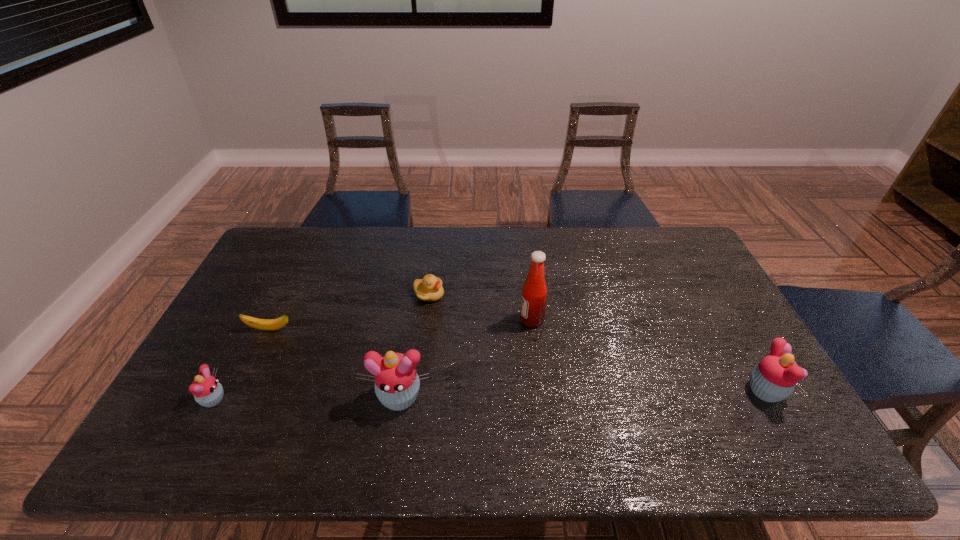
Locate an element on the screen. The image size is (960, 540). free space located 0.050m on the front-facing side of the tallest object is located at coordinates (503, 320).

Image resolution: width=960 pixels, height=540 pixels. Find the location of `free space located 0.240m on the front-facing side of the tallest object`. free space located 0.240m on the front-facing side of the tallest object is located at coordinates (440, 320).

Locate an element on the screen. vacant region located on the front-facing side of the tallest object is located at coordinates (460, 320).

Image resolution: width=960 pixels, height=540 pixels. I want to click on vacant region located 0.370m on the beak of the farthest object, so click(x=561, y=295).

You are a GUI agent. You are given a task and a screenshot of the screen. Output one action in this format:
    pyautogui.click(x=<x>, y=<y>)
    Task: Click on the free region located 0.400m at the stem of the banana
    
    Given the screenshot: What is the action you would take?
    pyautogui.click(x=432, y=329)

Where is `cupcake positioned at the left edge`? cupcake positioned at the left edge is located at coordinates (207, 391).

The width and height of the screenshot is (960, 540). Identify the location of banana present at the left edge. (264, 324).

Locate an element on the screen. The width and height of the screenshot is (960, 540). object that is at the right edge is located at coordinates (774, 378).

You are a GUI agent. You are given a task and a screenshot of the screen. Output one action in this format:
    pyautogui.click(x=<x>, y=<y>)
    Task: Click on the object that is at the near left corner
    The image size is (960, 540).
    Given the screenshot: What is the action you would take?
    pyautogui.click(x=207, y=391)

Locate an element on the screen. The image size is (960, 540). object at the near right corner is located at coordinates (774, 378).